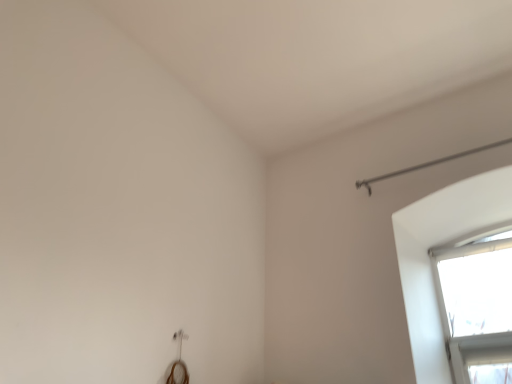
Locate an element on the screen. This screenshot has width=512, height=384. transparent glass door at upper right is located at coordinates (477, 307).

Describe the element at coordinates (477, 307) in the screenshot. The height and width of the screenshot is (384, 512). I see `transparent glass door at upper right` at that location.

Measure the distance between transparent glass door at upper right and camera.

transparent glass door at upper right and camera are 2.44 meters apart from each other.

What are the coordinates of `transparent glass door at upper right` in the screenshot? It's located at (477, 307).